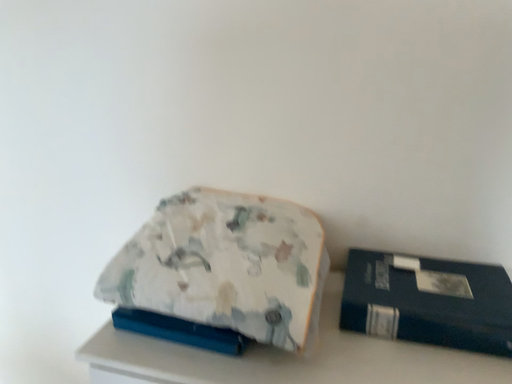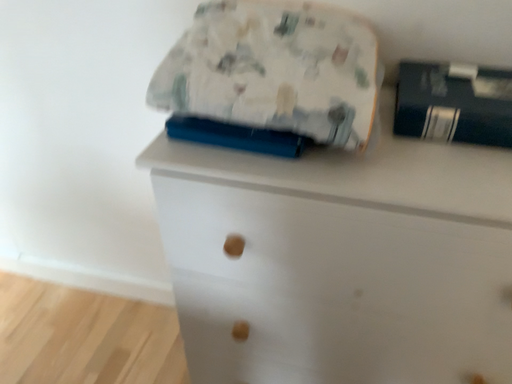
Question: Which way did the camera rotate in the video?

Choices:
 (A) rotated downward
 (B) rotated upward

Answer: (A)